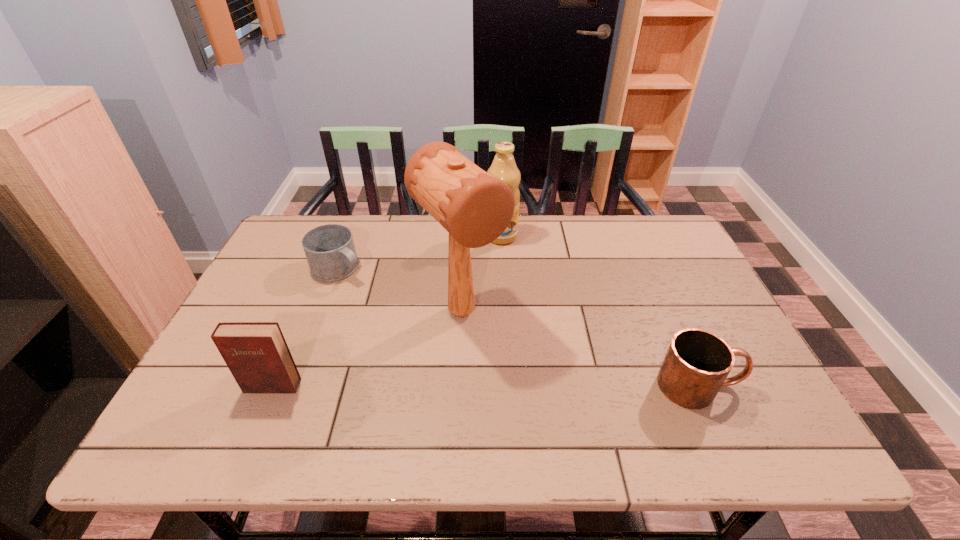
In order to click on diary in this screenshot , I will do `click(256, 353)`.

I want to click on the rightmost object, so click(697, 363).

I want to click on the nearer mug, so click(697, 363).

Locate an element on the screen. the second tallest object is located at coordinates (503, 167).

Locate an element on the screen. The image size is (960, 540). olive oil is located at coordinates (503, 167).

In order to click on the left mug in this screenshot , I will do `click(330, 251)`.

This screenshot has height=540, width=960. In order to click on mallet in this screenshot , I will do `click(475, 208)`.

Locate an element on the screen. Image resolution: width=960 pixels, height=540 pixels. vacant space situated 0.300m on the label of the fourth shortest object is located at coordinates (517, 315).

Where is `free spot located 0.100m on the label of the fourth shortest object`? free spot located 0.100m on the label of the fourth shortest object is located at coordinates (508, 266).

Where is `vacant region located on the label of the fourth shortest object`? vacant region located on the label of the fourth shortest object is located at coordinates (506, 260).